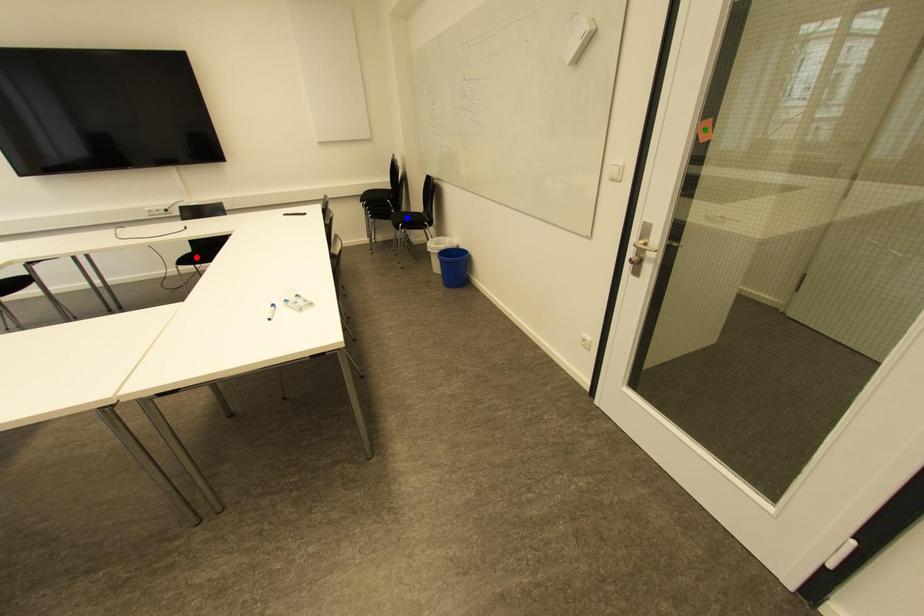
Order these from nearest to farthest:
A) red point
B) green point
C) blue point

blue point, red point, green point